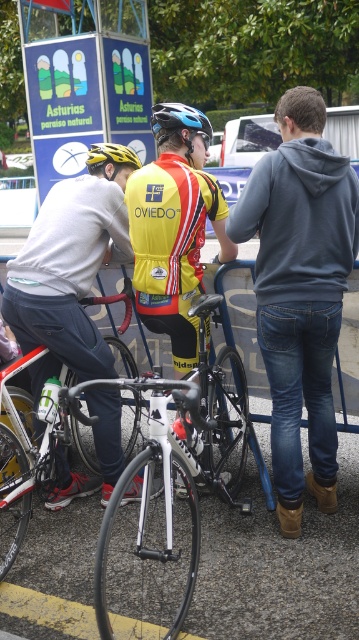
You are standing at the starting line of the cycling event. There are two points marked on the track ahead of you. The first point is at coordinates point (264, 202) and the second point is at point (166, 257). If you were to look towards the direction of the race, which point would you see first as you move forward?

Point (264, 202) is in front of point (166, 257), so you would see point (264, 202) first as you move forward.

You are a participant in a cycling event and need to quickly retrieve your matte blue bicycle helmet at center before starting the race. Your white metallic bicycle at center is currently blocking the path to your helmet. Can you easily reach your helmet without moving the bicycle?

The distance between the white metallic bicycle at center and matte blue bicycle helmet at center is 6.46 feet, so you can easily reach the matte blue bicycle helmet at center without needing to move the bicycle since there is enough space between them.

You are a photographer positioned at the back of the scene. You want to capture both the denim jeans at center and the yellow fabric safety vest at center in a single shot. Which object will appear larger in the photo?

The denim jeans at center will appear larger in the photo because it is much taller than the yellow fabric safety vest at center.